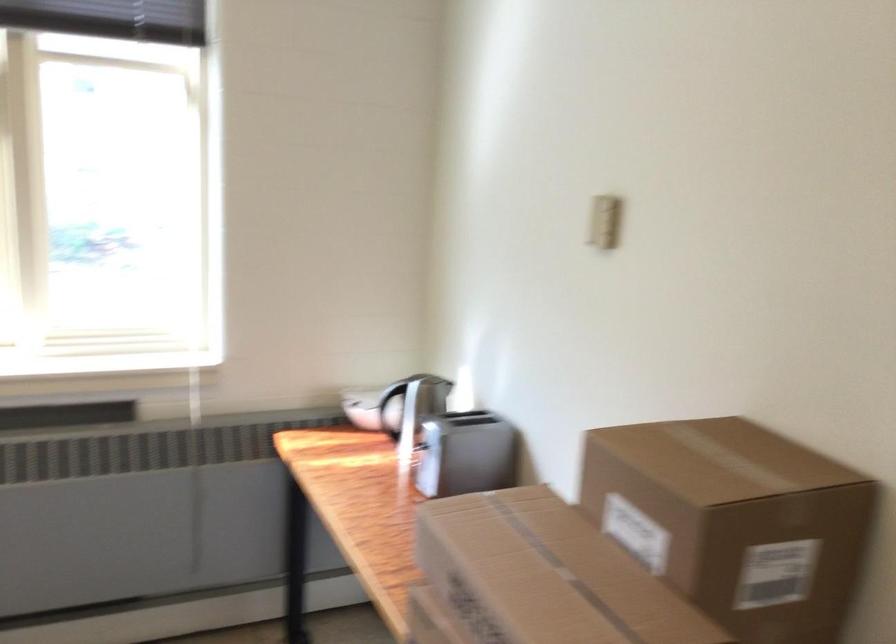
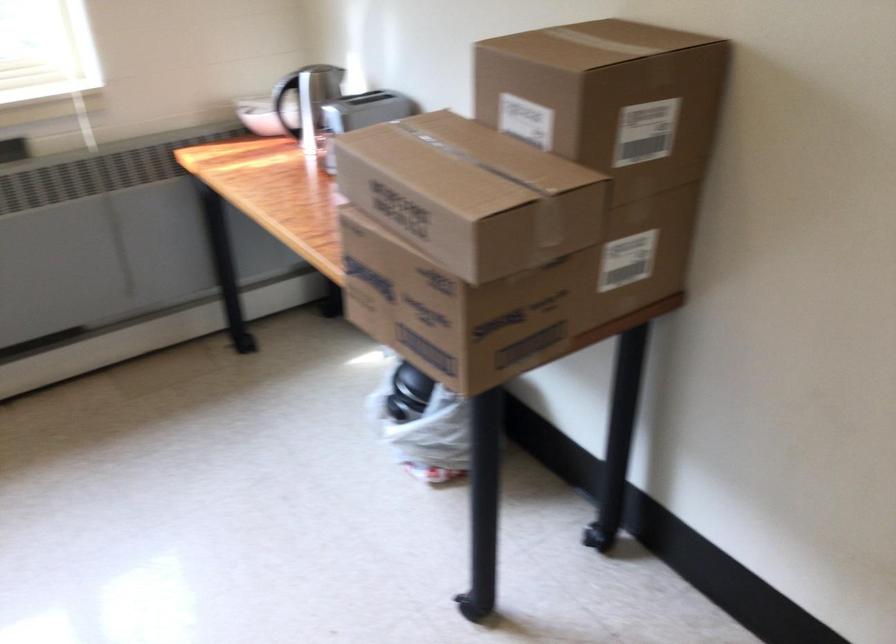
Locate, in the second image, the point that corresponds to pixel 409 509 in the first image.

(323, 138)